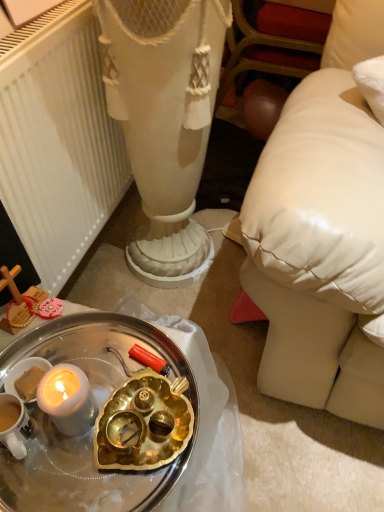
Question: Considering the positions of white matte radiator at left and white metallic tray at lower left in the image, is white matte radiator at left bigger or smaller than white metallic tray at lower left?

Choices:
 (A) big
 (B) small

Answer: (A)

Question: Is white matte radiator at left situated inside white metallic tray at lower left or outside?

Choices:
 (A) outside
 (B) inside

Answer: (A)

Question: From a real-world perspective, is white matte radiator at left positioned above or below white metallic tray at lower left?

Choices:
 (A) below
 (B) above

Answer: (A)

Question: Is white metallic tray at lower left in front of or behind white matte radiator at left in the image?

Choices:
 (A) behind
 (B) front

Answer: (B)

Question: From the image's perspective, is white metallic tray at lower left above or below white matte radiator at left?

Choices:
 (A) below
 (B) above

Answer: (A)

Question: From a real-world perspective, is white metallic tray at lower left above or below white matte radiator at left?

Choices:
 (A) below
 (B) above

Answer: (B)

Question: Is white metallic tray at lower left to the left or to the right of white matte radiator at left in the image?

Choices:
 (A) left
 (B) right

Answer: (B)